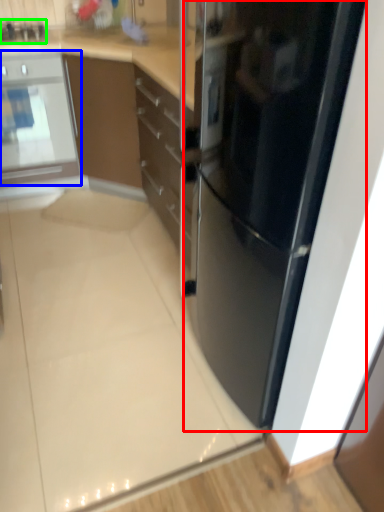
Question: Which object is the farthest from refrigerator (highlighted by a red box)? Choose among these: home appliance (highlighted by a blue box) or appliance (highlighted by a green box).

Choices:
 (A) home appliance
 (B) appliance

Answer: (B)